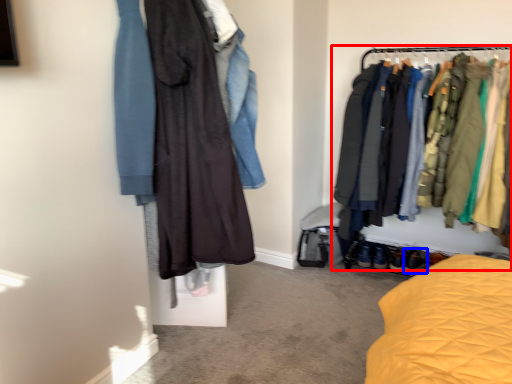
Question: Among these objects, which one is nearest to the camera, closet (highlighted by a red box) or footwear (highlighted by a blue box)?

Choices:
 (A) closet
 (B) footwear

Answer: (A)